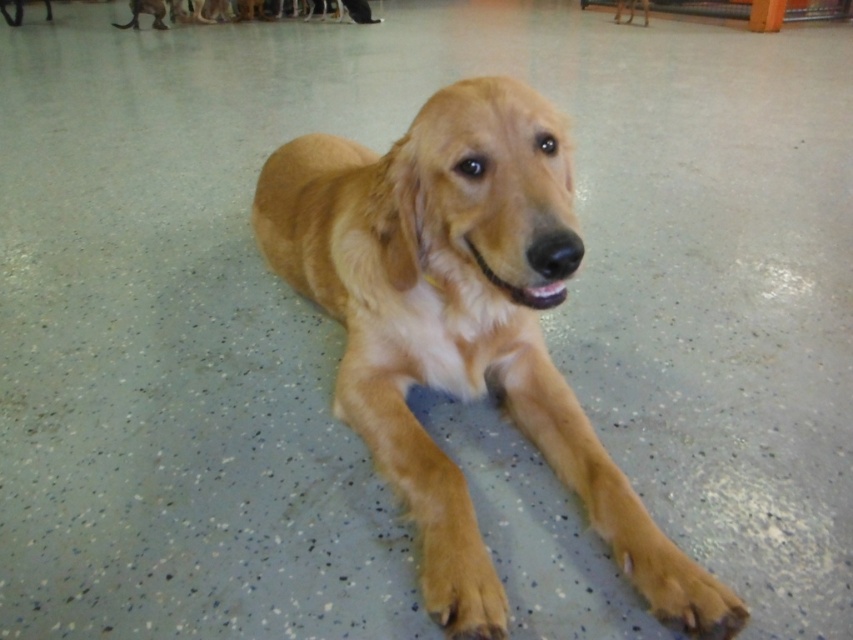
In the scene shown: Who is positioned more to the right, golden fur dog at center or golden fur paw at lower center?

Positioned to the right is golden fur paw at lower center.

Who is positioned more to the left, golden fur dog at center or golden fur paw at lower center?

golden fur dog at center is more to the left.

Find the location of `golden fur dog at center`. golden fur dog at center is located at coordinates (463, 308).